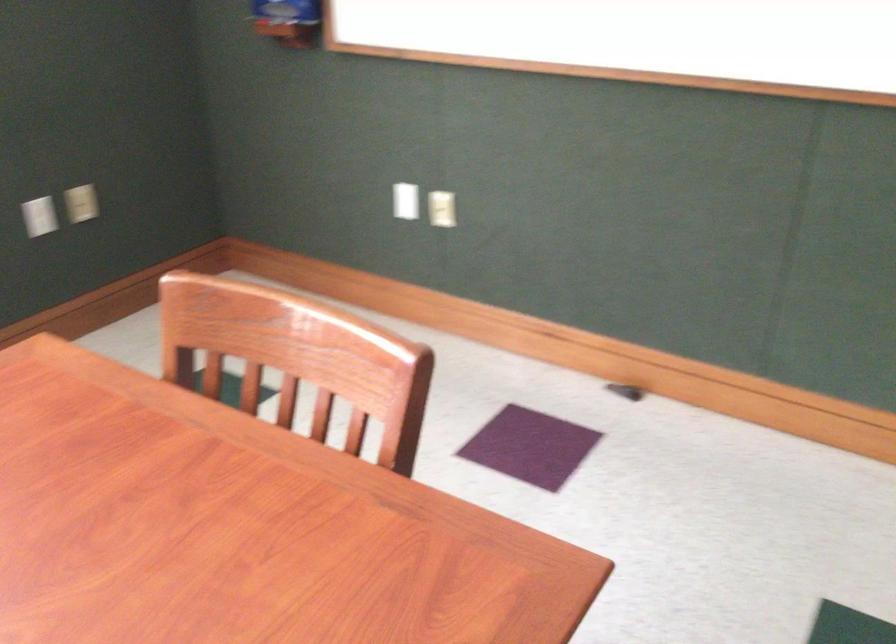
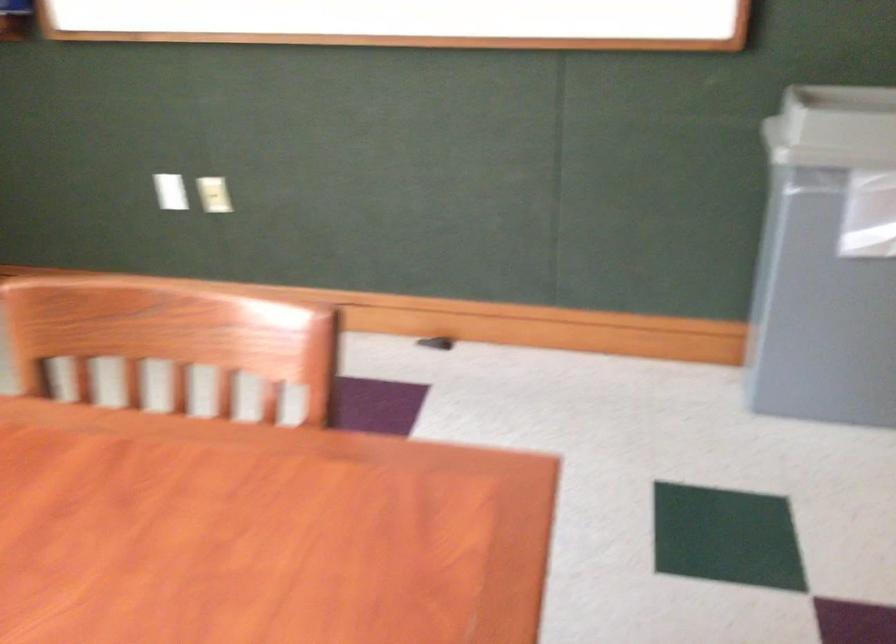
Question: Based on the continuous images, in which direction is the camera rotating? Reply with the corresponding letter.

Choices:
 (A) Left
 (B) Right
 (C) Up
 (D) Down

Answer: (B)